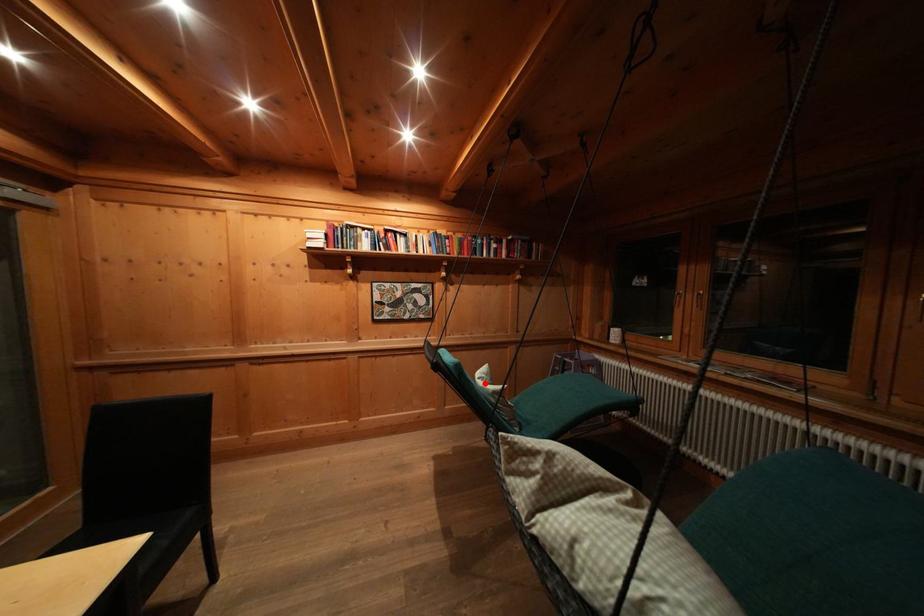
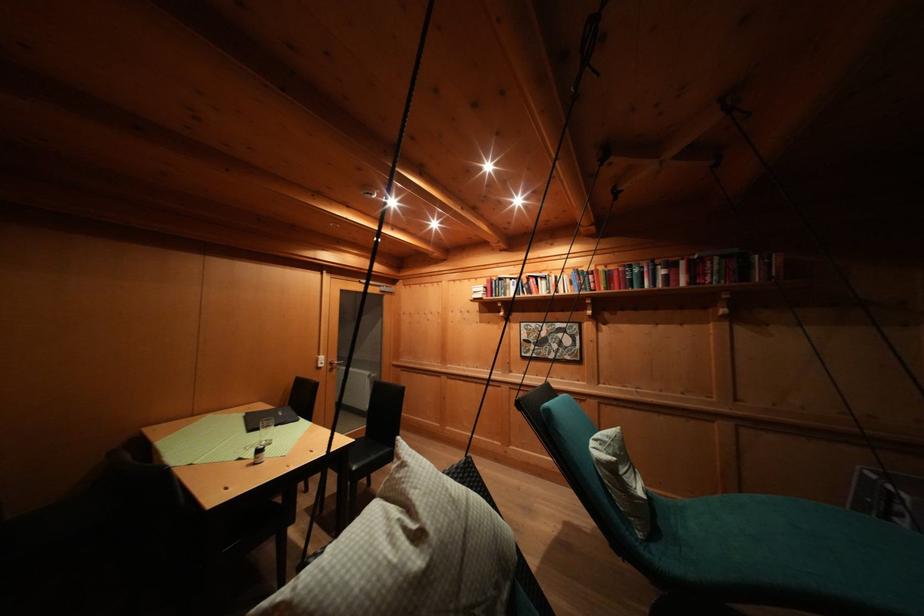
Find the pixel in the second image that matches the highlighted location in the first image.

(602, 445)